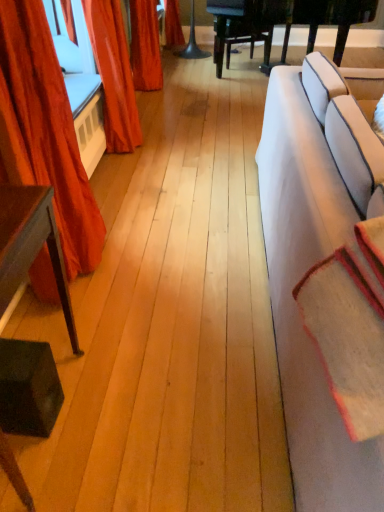
Locate an element on the screen. This screenshot has width=384, height=512. vacant space behind velvet red curtain at left, acting as the 2th curtain starting from the back is located at coordinates (124, 209).